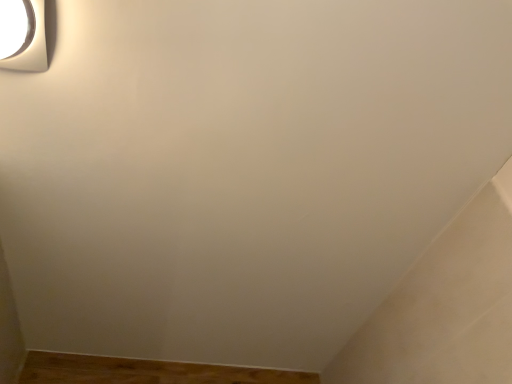
Find the location of a particular element. This screenshot has height=384, width=512. satin nickel light fixture at upper left is located at coordinates (32, 46).

This screenshot has width=512, height=384. What do you see at coordinates (32, 46) in the screenshot?
I see `satin nickel light fixture at upper left` at bounding box center [32, 46].

Find the location of a particular element. The image size is (512, 384). satin nickel light fixture at upper left is located at coordinates (32, 46).